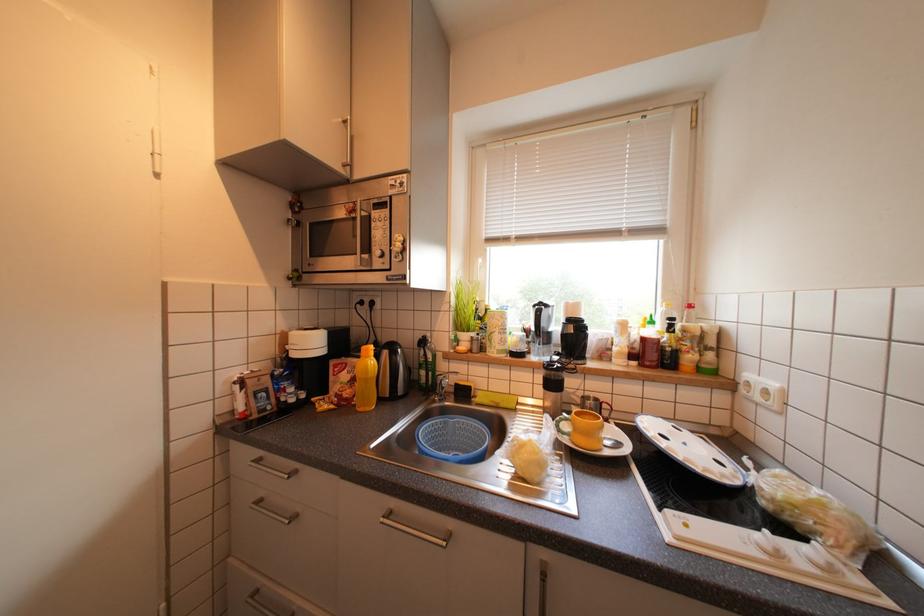
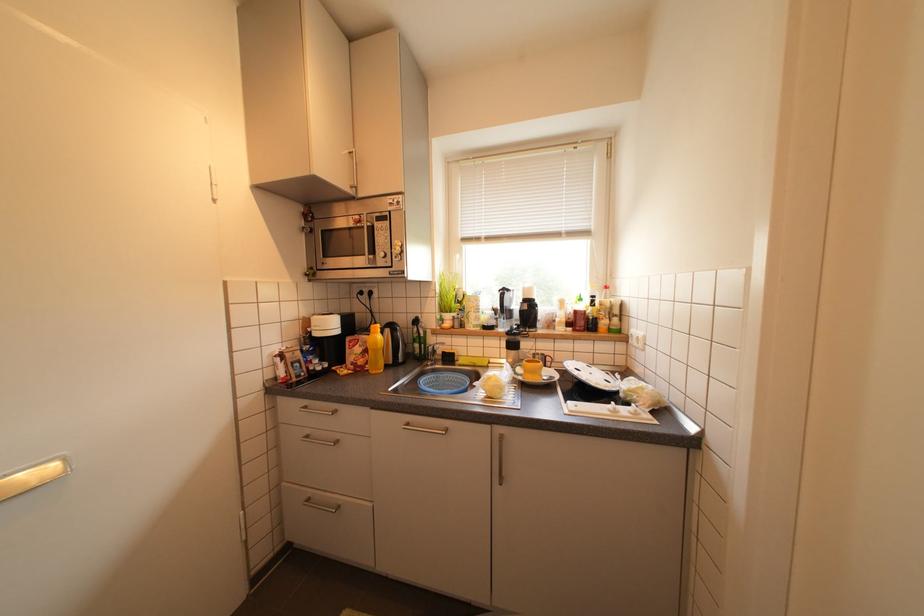
Question: The first image is from the beginning of the video and the second image is from the end. How did the camera likely rotate when shooting the video?

Choices:
 (A) Left
 (B) Right
 (C) Up
 (D) Down

Answer: (B)